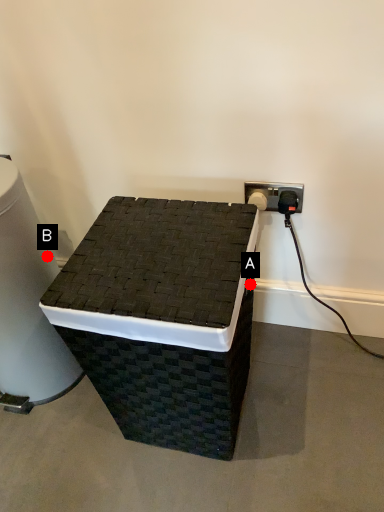
Question: Two points are circled on the image, labeled by A and B beside each circle. Which point is farther from the camera taking this photo?

Choices:
 (A) A is further
 (B) B is further

Answer: (A)